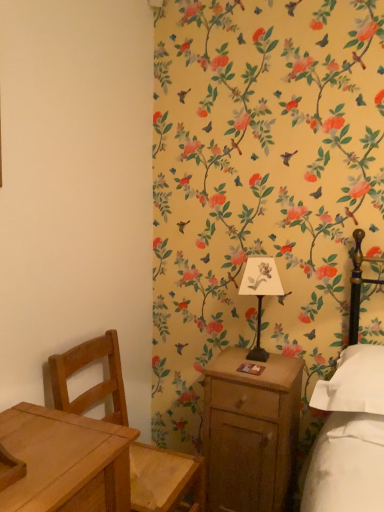
This screenshot has width=384, height=512. What do you see at coordinates (260, 293) in the screenshot?
I see `metallic black bedside lamp at center-right` at bounding box center [260, 293].

Where is `metallic black bedside lamp at center-right`? metallic black bedside lamp at center-right is located at coordinates (260, 293).

Is point (253, 261) more distant than point (247, 388)?

Yes.

Who is bigger, metallic black bedside lamp at center-right or wooden nightstand at right?

wooden nightstand at right.

Can you confirm if metallic black bedside lamp at center-right is thinner than wooden nightstand at right?

Yes.

How different are the orientations of metallic black bedside lamp at center-right and wooden nightstand at right in degrees?

The facing directions of metallic black bedside lamp at center-right and wooden nightstand at right are 3.87 degrees apart.

At what (x,y) coordinates should I click in order to perform the action: click on chair on the left of metallic black bedside lamp at center-right. Please return your answer as a coordinate pair (x, y). The image size is (384, 512). Looking at the image, I should click on click(x=164, y=480).

Which object is wider, light brown wooden chair at left or metallic black bedside lamp at center-right?

Wider between the two is light brown wooden chair at left.

In terms of size, does light brown wooden chair at left appear bigger or smaller than metallic black bedside lamp at center-right?

Considering their sizes, light brown wooden chair at left takes up more space than metallic black bedside lamp at center-right.

Is wooden nightstand at right at the right side of metallic black bedside lamp at center-right?

In fact, wooden nightstand at right is to the left of metallic black bedside lamp at center-right.

Between wooden nightstand at right and metallic black bedside lamp at center-right, which one has more height?

wooden nightstand at right is taller.

Which is correct: wooden nightstand at right is inside metallic black bedside lamp at center-right, or outside of it?

The correct answer is: outside.

Who is smaller, wooden nightstand at right or metallic black bedside lamp at center-right?

Smaller between the two is metallic black bedside lamp at center-right.

How far apart are light brown wooden chair at left and wooden nightstand at right?

light brown wooden chair at left and wooden nightstand at right are 13.00 inches apart.

Is light brown wooden chair at left at the right side of wooden nightstand at right?

No.

From a real-world perspective, is light brown wooden chair at left on wooden nightstand at right?

Yes, from a real-world perspective, light brown wooden chair at left is above wooden nightstand at right.

Is point (123, 393) in front of point (265, 461)?

No, it is behind (265, 461).

From the picture: Does metallic black bedside lamp at center-right have a larger size compared to light brown wooden chair at left?

Incorrect, metallic black bedside lamp at center-right is not larger than light brown wooden chair at left.

Is light brown wooden chair at left located within metallic black bedside lamp at center-right?

Definitely not — light brown wooden chair at left is not inside metallic black bedside lamp at center-right.

Considering the points (249, 275) and (138, 462), which point is in front, point (249, 275) or point (138, 462)?

Positioned in front is point (138, 462).

Consider the image. Are metallic black bedside lamp at center-right and light brown wooden chair at left located far from each other?

metallic black bedside lamp at center-right is near light brown wooden chair at left, not far away.

From a real-world perspective, is wooden nightstand at right physically below light brown wooden chair at left?

Yes, from a real-world perspective, wooden nightstand at right is under light brown wooden chair at left.

Can you tell me how much wooden nightstand at right and light brown wooden chair at left differ in facing direction?

89.6 degrees.

Is wooden nightstand at right facing towards light brown wooden chair at left?

No, wooden nightstand at right is not aimed at light brown wooden chair at left.

Where is `nightstand located underneath the light brown wooden chair at left (from a real-world perspective)`? The width and height of the screenshot is (384, 512). nightstand located underneath the light brown wooden chair at left (from a real-world perspective) is located at coordinates (250, 432).

You are a GUI agent. You are given a task and a screenshot of the screen. Output one action in this format:
    pyautogui.click(x=<x>, y=<y>)
    Task: Click on the nightstand located in front of the metallic black bedside lamp at center-right
    
    Given the screenshot: What is the action you would take?
    pyautogui.click(x=250, y=432)

At what (x,y) coordinates should I click in order to perform the action: click on chair lying on the left of metallic black bedside lamp at center-right. Please return your answer as a coordinate pair (x, y). Looking at the image, I should click on (164, 480).

From the image, which object appears to be nearer to metallic black bedside lamp at center-right, wooden nightstand at right or light brown wooden chair at left?

wooden nightstand at right is positioned closer to the anchor metallic black bedside lamp at center-right.

From the image, which object appears to be nearer to metallic black bedside lamp at center-right, light brown wooden chair at left or wooden nightstand at right?

wooden nightstand at right.

Looking at the image, which one is located closer to light brown wooden chair at left, wooden nightstand at right or metallic black bedside lamp at center-right?

Based on the image, wooden nightstand at right appears to be nearer to light brown wooden chair at left.

Considering their positions, is metallic black bedside lamp at center-right positioned further to wooden nightstand at right than light brown wooden chair at left?

Among the two, light brown wooden chair at left is located further to wooden nightstand at right.

Looking at the image, which one is located closer to light brown wooden chair at left, metallic black bedside lamp at center-right or wooden nightstand at right?

wooden nightstand at right.

Looking at the image, which one is located further to wooden nightstand at right, light brown wooden chair at left or metallic black bedside lamp at center-right?

light brown wooden chair at left is further to wooden nightstand at right.

Where is `chair between metallic black bedside lamp at center-right and wooden nightstand at right in the up-down direction`? chair between metallic black bedside lamp at center-right and wooden nightstand at right in the up-down direction is located at coordinates (164, 480).